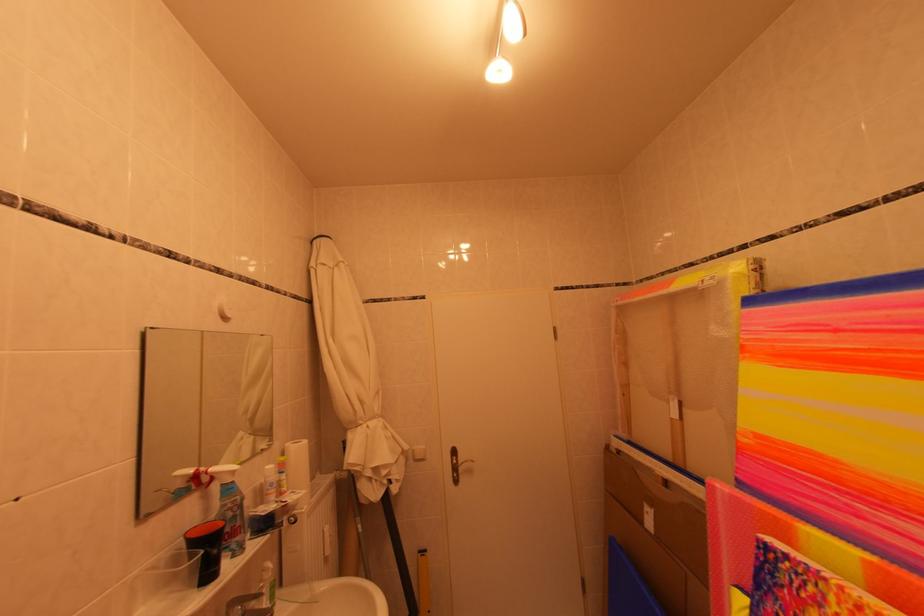
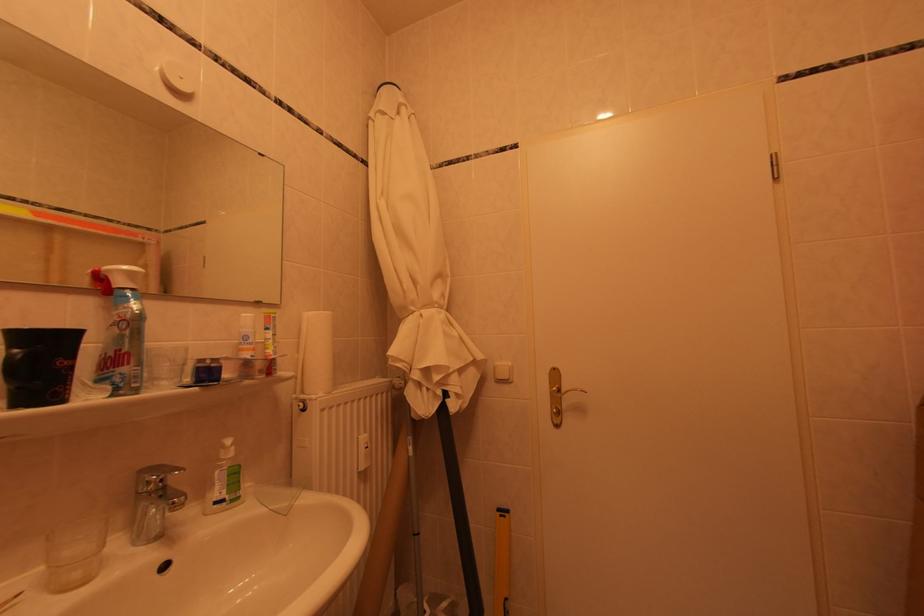
Question: The camera is either moving clockwise (left) or counter-clockwise (right) around the object. The first image is from the beginning of the video and the second image is from the end. Is the camera moving left or right when shooting the video?

Choices:
 (A) Left
 (B) Right

Answer: (B)